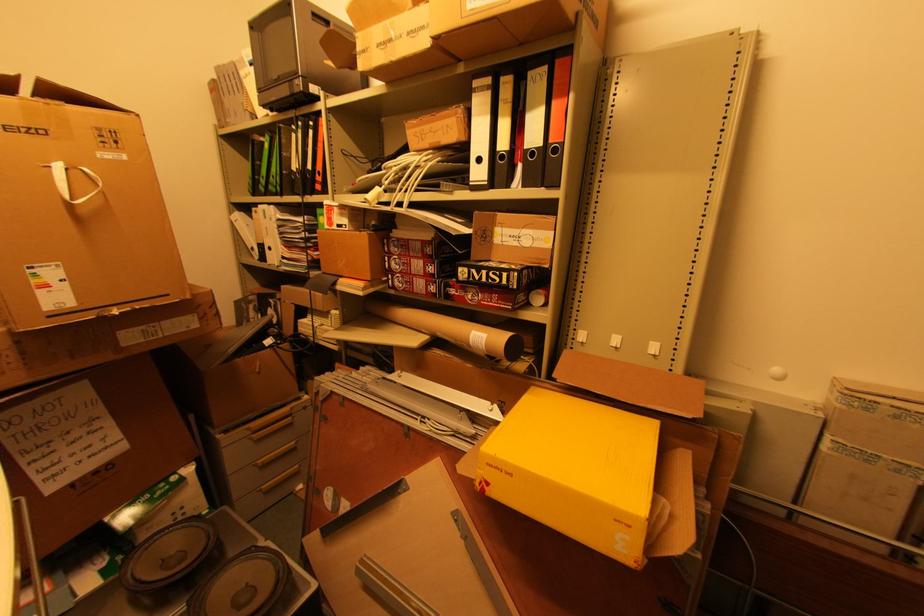
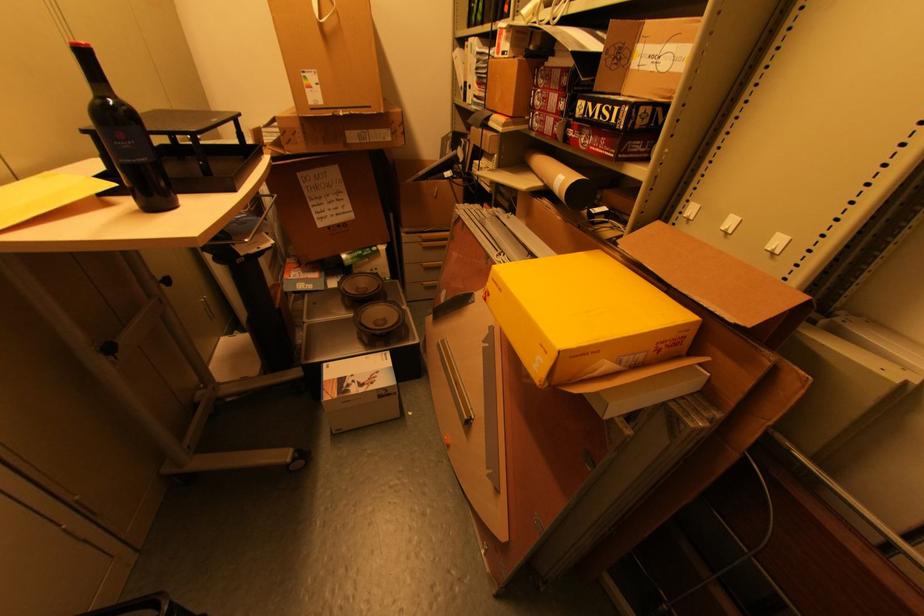
Locate, in the second image, the point that corresponds to (x=262, y=463) in the first image.

(428, 265)